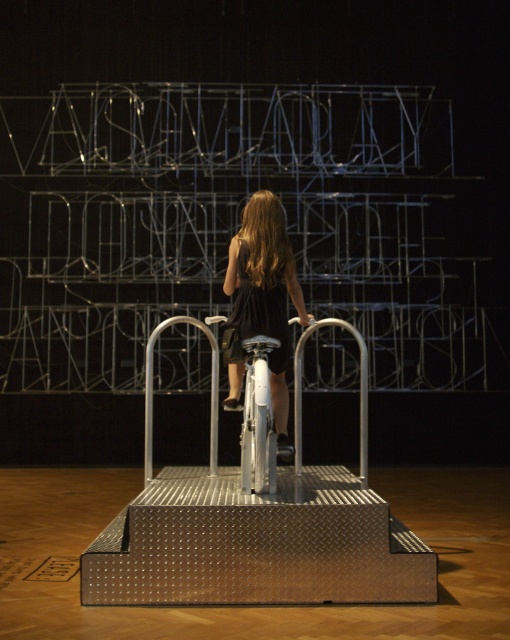
Looking at this image, can you confirm if silver metallic rail at center is wider than black satin dress at center?

Yes.

Is silver metallic rail at center positioned before black satin dress at center?

Yes.

Image resolution: width=510 pixels, height=640 pixels. Find the location of `silver metallic rail at center`. silver metallic rail at center is located at coordinates (151, 394).

Does black matte dress at center have a smaller size compared to silver metallic rail at center?

Actually, black matte dress at center might be larger than silver metallic rail at center.

Who is higher up, black matte dress at center or silver metallic rail at center?

black matte dress at center

Image resolution: width=510 pixels, height=640 pixels. Identify the location of black matte dress at center. (265, 291).

Does black matte dress at center have a greater width compared to black satin dress at center?

Yes, black matte dress at center is wider than black satin dress at center.

Can you confirm if black matte dress at center is positioned to the right of black satin dress at center?

Yes, black matte dress at center is to the right of black satin dress at center.

At what (x,y) coordinates should I click in order to perform the action: click on black matte dress at center. Please return your answer as a coordinate pair (x, y). The width and height of the screenshot is (510, 640). Looking at the image, I should click on (265, 291).

At what (x,y) coordinates should I click in order to perform the action: click on black matte dress at center. Please return your answer as a coordinate pair (x, y). The height and width of the screenshot is (640, 510). Looking at the image, I should click on (265, 291).